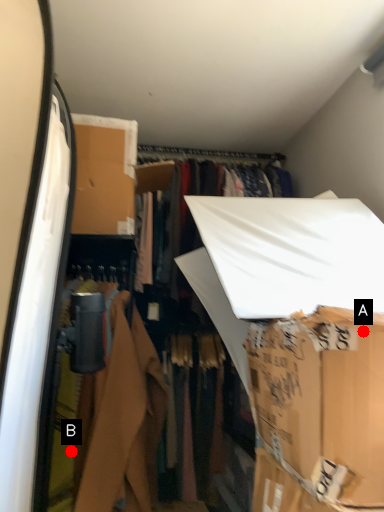
Question: Two points are circled on the image, labeled by A and B beside each circle. Which point is farther from the camera taking this photo?

Choices:
 (A) A is further
 (B) B is further

Answer: (B)